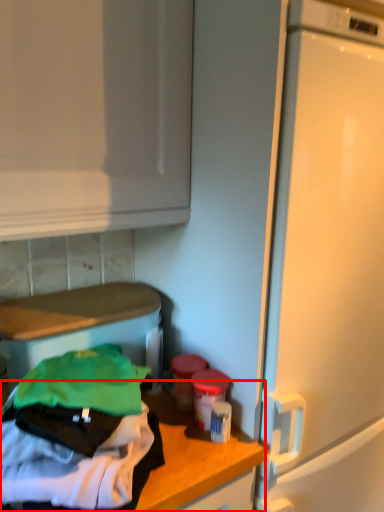
Question: From the image's perspective, what is the correct spatial positioning of countertop (annotated by the red box) in reference to appliance?

Choices:
 (A) below
 (B) above

Answer: (A)